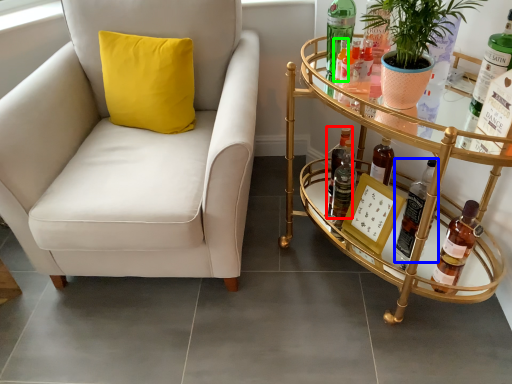
Question: Estimate the real-world distances between objects in this image. Which object is closer to beer bottle (highlighted by a red box), bottle (highlighted by a blue box) or bottle (highlighted by a green box)?

Choices:
 (A) bottle
 (B) bottle

Answer: (A)